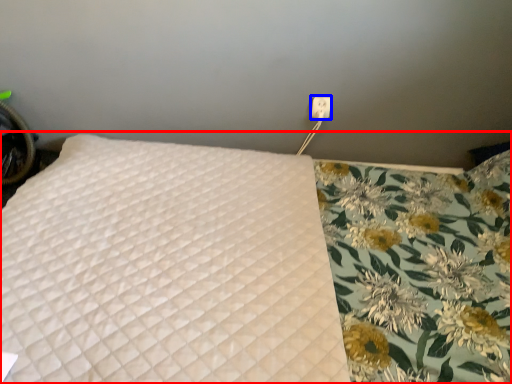
Question: Which point is further to the camera, bed (highlighted by a red box) or electric outlet (highlighted by a blue box)?

Choices:
 (A) bed
 (B) electric outlet

Answer: (B)